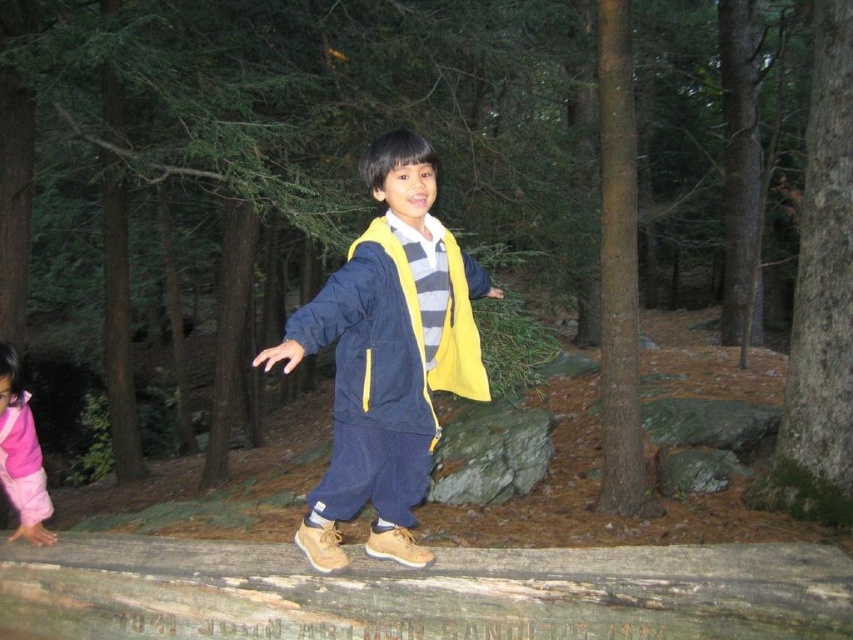
You are a photographer standing at the camera position. You want to take a photo of the matte blue jacket at center. However, you notice that the jacket is slightly out of focus. What adjustment can you make to ensure the jacket is in focus?

Since the matte blue jacket at center is 1.69 meters from the camera, you should adjust the focus distance to 1.69 meters to ensure the jacket is in focus.